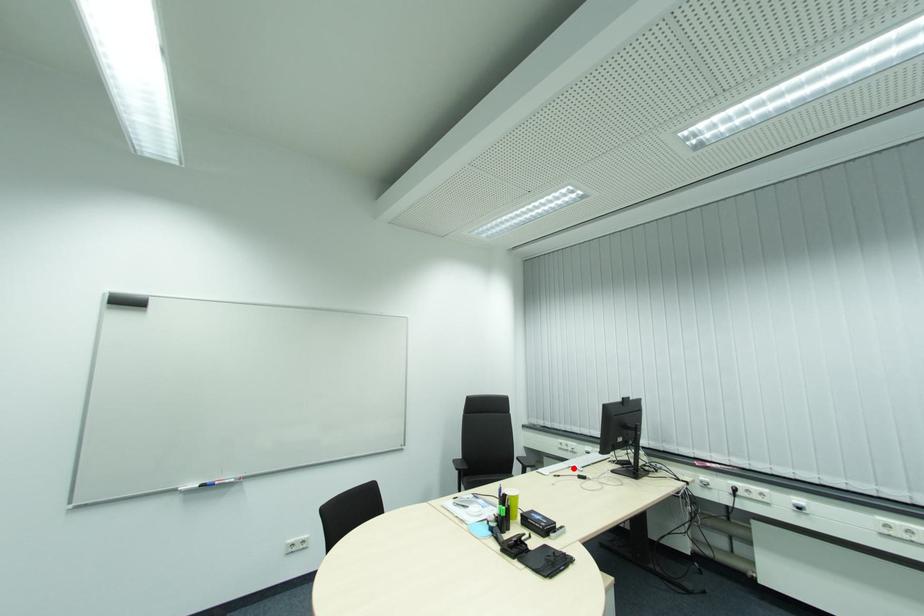
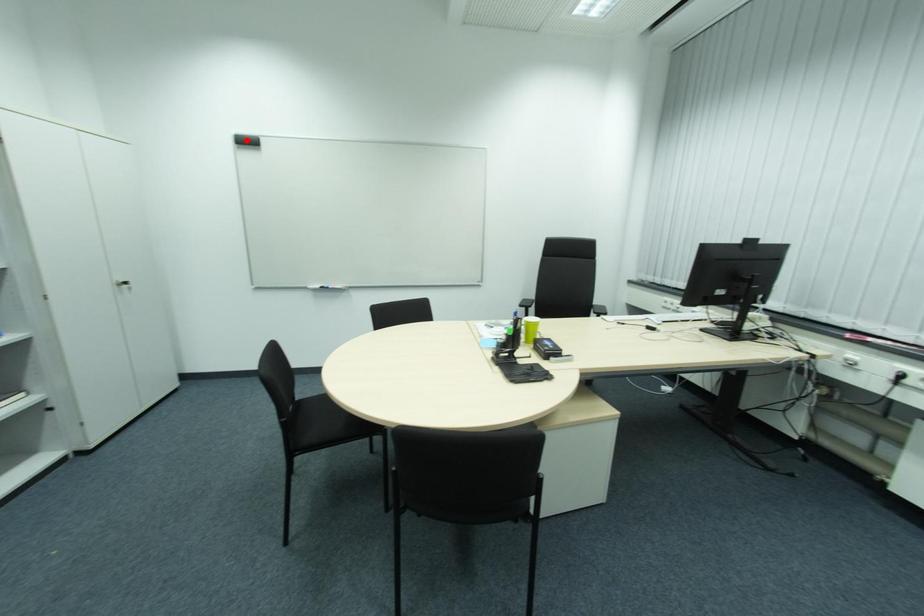
I am providing you with two images of the same scene from different viewpoints. A red point is marked on the first image and another point is marked on the second image. Are the points marked in image1 and image2 representing the same 3D position?

No